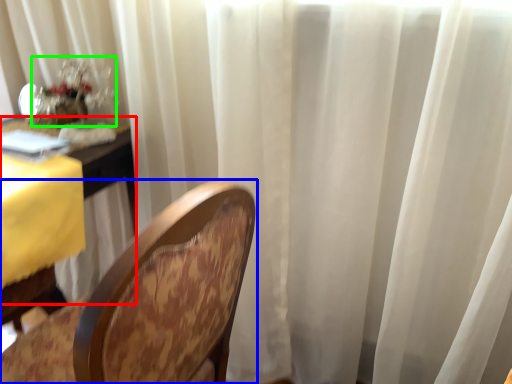
Question: Considering the real-world distances, which object is closest to table (highlighted by a red box)? chair (highlighted by a blue box) or floral arrangement (highlighted by a green box).

Choices:
 (A) chair
 (B) floral arrangement

Answer: (B)